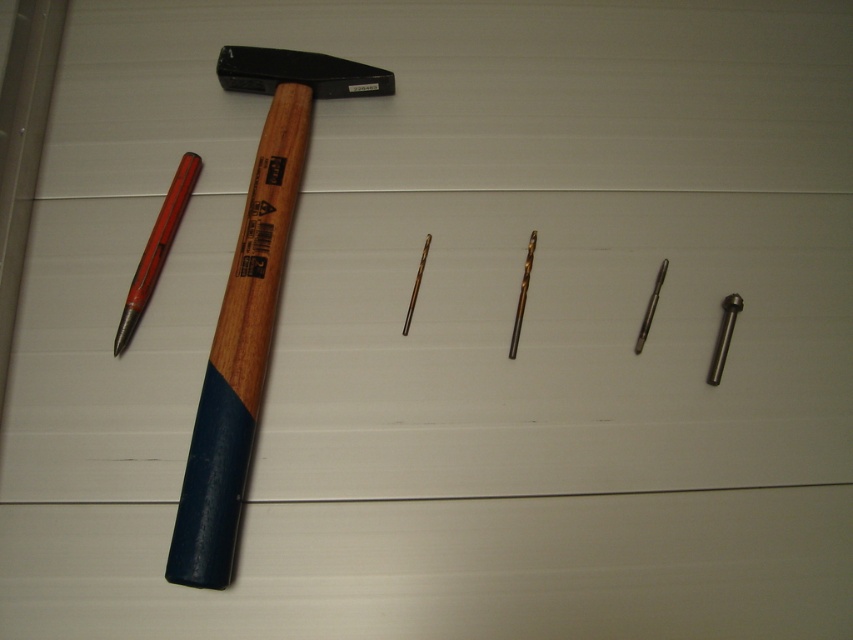
Between wooden handle hammer at left and red plastic pen at left, which one is positioned lower?

wooden handle hammer at left

Who is more distant from viewer, (x=207, y=426) or (x=183, y=193)?

Point (x=183, y=193)

Identify the location of wooden handle hammer at left. The image size is (853, 640). (251, 300).